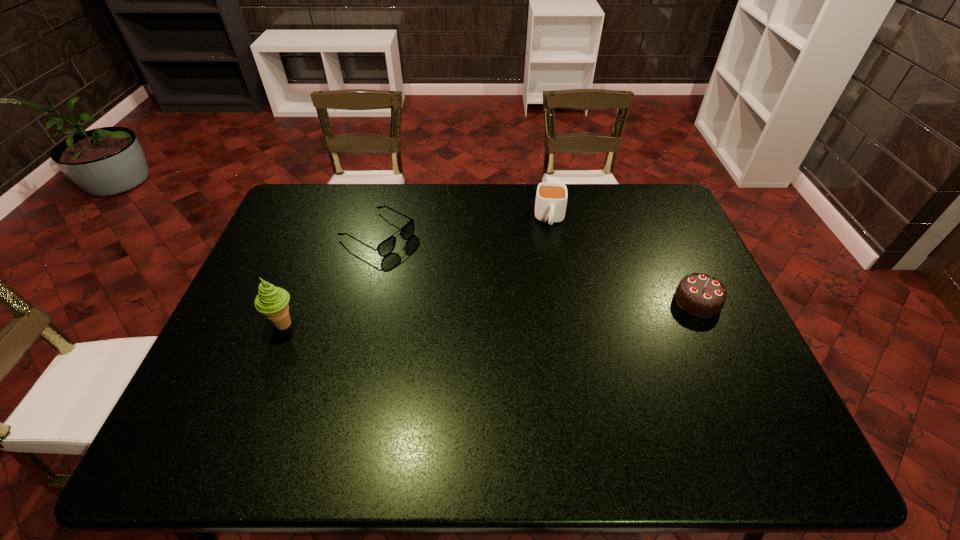
The width and height of the screenshot is (960, 540). I want to click on vacant space located 0.090m on the side with the handle of the third object from left to right, so click(552, 253).

Locate an element on the screen. free location located on the front-facing side of the spectacles is located at coordinates (461, 279).

Locate an element on the screen. vacant region located on the front-facing side of the spectacles is located at coordinates (x=480, y=289).

Identify the location of vacant space located 0.380m on the front-facing side of the spectacles. The height and width of the screenshot is (540, 960). (506, 303).

Locate an element on the screen. The height and width of the screenshot is (540, 960). cup at the far edge is located at coordinates (551, 198).

You are a GUI agent. You are given a task and a screenshot of the screen. Output one action in this format:
    pyautogui.click(x=<x>, y=<y>)
    Task: Click on the spectacles at the far edge
    This screenshot has width=960, height=540.
    Given the screenshot: What is the action you would take?
    pyautogui.click(x=386, y=247)

You are a GUI agent. You are given a task and a screenshot of the screen. Output one action in this format:
    pyautogui.click(x=<x>, y=<y>)
    Task: Click on the object situated at the left edge
    
    Given the screenshot: What is the action you would take?
    pyautogui.click(x=271, y=301)

Where is `object that is at the right edge`? object that is at the right edge is located at coordinates (701, 295).

Identify the location of free region at the far edge of the desktop. (492, 206).

At what (x,y) coordinates should I click in order to perform the action: click on free space at the near edge of the desktop. Please return your answer as a coordinate pair (x, y). Looking at the image, I should click on (454, 383).